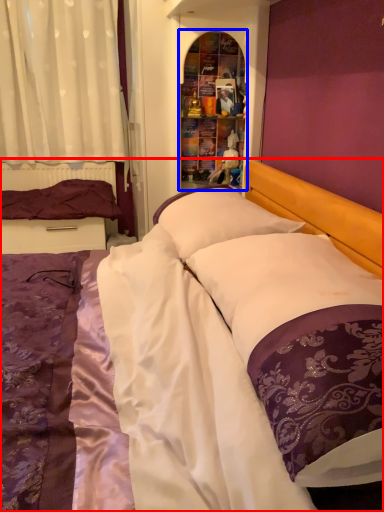
Question: Which of the following is the farthest to the observer, bed (highlighted by a red box) or shelf (highlighted by a blue box)?

Choices:
 (A) bed
 (B) shelf

Answer: (B)